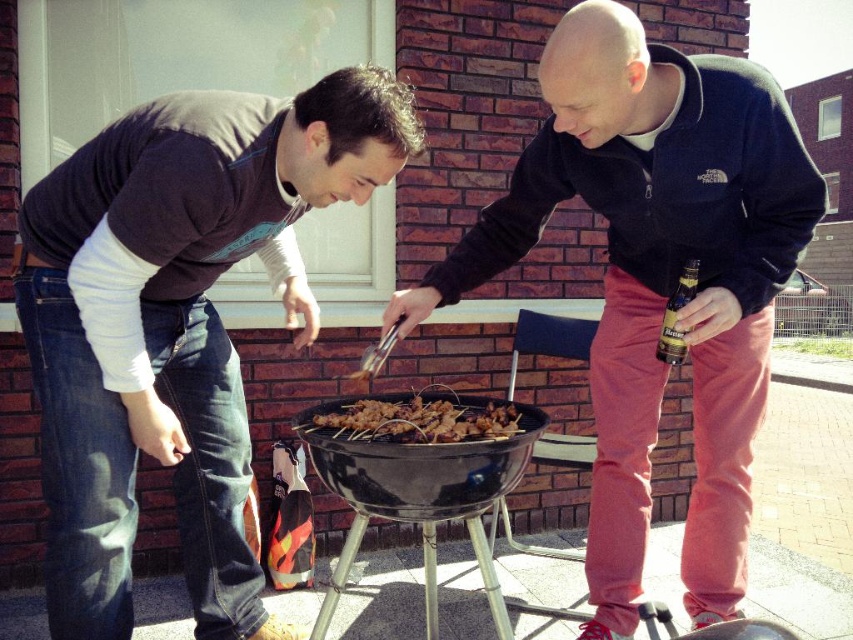
Consider the image. You are planning to place a decorative plate on top of the matte black grill at center. Considering the height of the brown glossy skewers at center, will the plate be stable?

The matte black grill at center is taller than brown glossy skewers at center, so the plate placed on top of the matte black grill at center will be stable as it is higher than the skewers.

You are planning to place a 18 inch long wooden board between the matte black grill at center and the brown glossy skewers at center. Can the board fit between them without overlapping?

The matte black grill at center is 17.36 inches away from the brown glossy skewers at center. Since the board is 18 inches long, it cannot fit between them without overlapping.